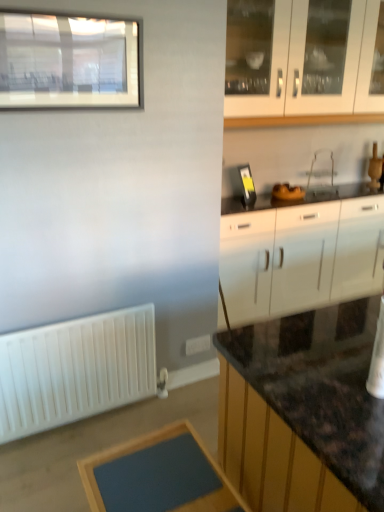
Question: Does matte glass window at upper left have a smaller size compared to blue matte table at lower center?

Choices:
 (A) yes
 (B) no

Answer: (B)

Question: Can you confirm if matte glass window at upper left is shorter than blue matte table at lower center?

Choices:
 (A) yes
 (B) no

Answer: (B)

Question: From a real-world perspective, is matte glass window at upper left beneath blue matte table at lower center?

Choices:
 (A) no
 (B) yes

Answer: (A)

Question: Can you confirm if matte glass window at upper left is bigger than blue matte table at lower center?

Choices:
 (A) no
 (B) yes

Answer: (B)

Question: Is matte glass window at upper left taller than blue matte table at lower center?

Choices:
 (A) no
 (B) yes

Answer: (B)

Question: Is white glossy cabinet at upper right, marked as the second cabinetry in a bottom-to-top arrangement, in front of or behind white matte radiator at lower left in the image?

Choices:
 (A) behind
 (B) front

Answer: (A)

Question: In terms of size, does white glossy cabinet at upper right, marked as the second cabinetry in a bottom-to-top arrangement, appear bigger or smaller than white matte radiator at lower left?

Choices:
 (A) big
 (B) small

Answer: (A)

Question: From a real-world perspective, is white glossy cabinet at upper right, marked as the second cabinetry in a bottom-to-top arrangement, physically located above or below white matte radiator at lower left?

Choices:
 (A) below
 (B) above

Answer: (B)

Question: From the image's perspective, is white glossy cabinet at upper right, which ranks as the first cabinetry in top-to-bottom order, above or below white matte radiator at lower left?

Choices:
 (A) above
 (B) below

Answer: (A)

Question: Considering the positions of white plastic electric outlet at lower center and white matte radiator at lower left in the image, is white plastic electric outlet at lower center wider or thinner than white matte radiator at lower left?

Choices:
 (A) thin
 (B) wide

Answer: (A)

Question: In the image, is white plastic electric outlet at lower center positioned in front of or behind white matte radiator at lower left?

Choices:
 (A) behind
 (B) front

Answer: (A)

Question: Is point (200, 337) closer or farther from the camera than point (102, 385)?

Choices:
 (A) farther
 (B) closer

Answer: (A)

Question: From a real-world perspective, is white plastic electric outlet at lower center physically located above or below white matte radiator at lower left?

Choices:
 (A) below
 (B) above

Answer: (A)

Question: Which is correct: white glossy cabinet at right, the first cabinetry positioned from the bottom, is inside clear plastic sink at center, or outside of it?

Choices:
 (A) inside
 (B) outside

Answer: (B)

Question: From the image's perspective, is white glossy cabinet at right, which appears as the second cabinetry when viewed from the top, above or below clear plastic sink at center?

Choices:
 (A) above
 (B) below

Answer: (B)